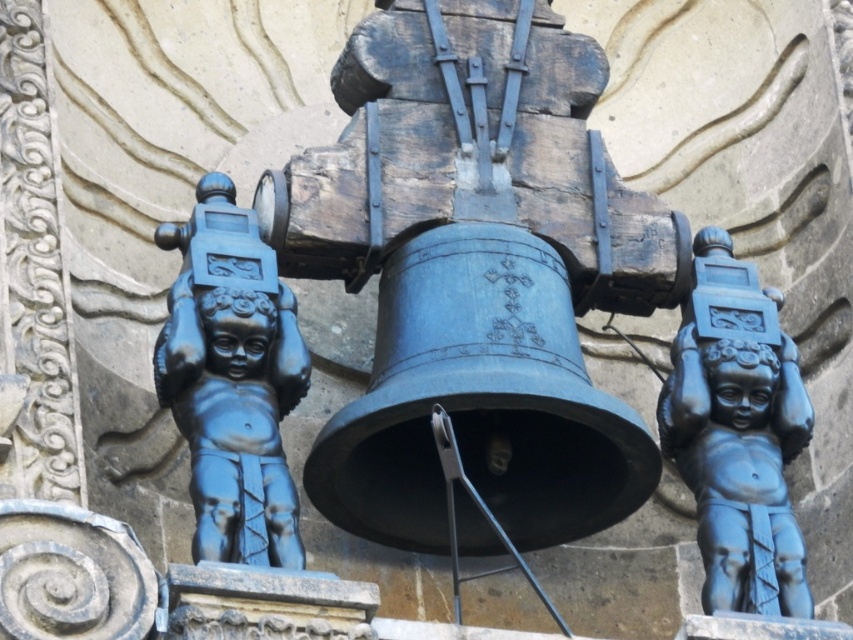
Who is more distant from viewer, (253, 557) or (715, 547)?

The point (715, 547) is behind.

Does point (285, 502) lie behind point (761, 371)?

No, (285, 502) is closer to viewer.

Does point (236, 378) come farther from viewer compared to point (689, 330)?

No, (236, 378) is in front of (689, 330).

Find the location of a particular element. matte black cherub at left is located at coordinates (231, 380).